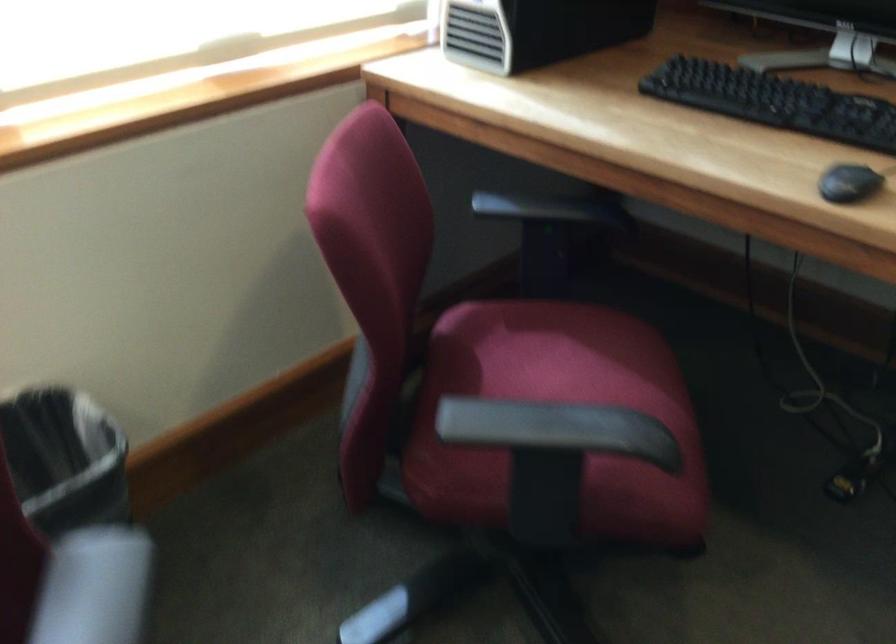
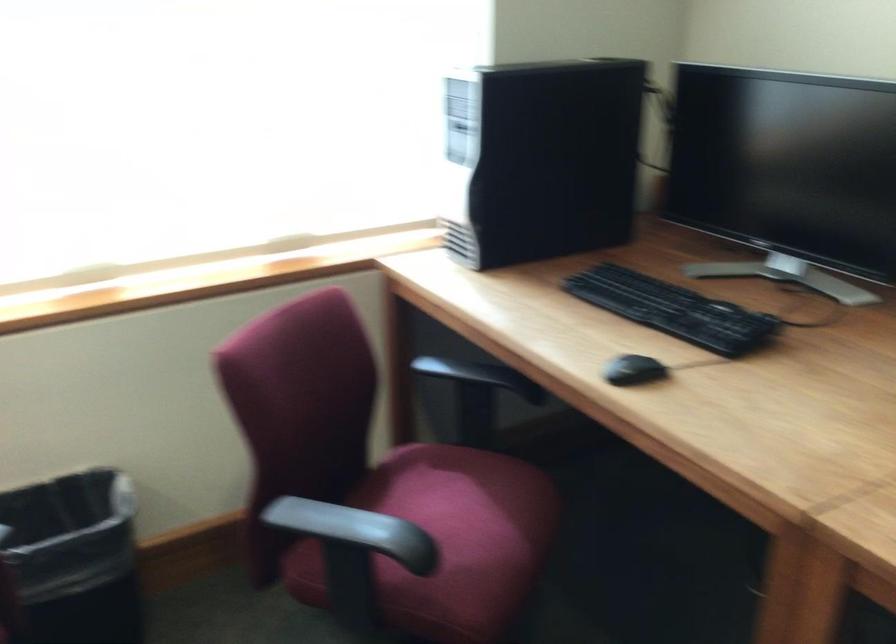
Question: The first image is from the beginning of the video and the second image is from the end. How did the camera likely rotate when shooting the video?

Choices:
 (A) Left
 (B) Right
 (C) Up
 (D) Down

Answer: (A)